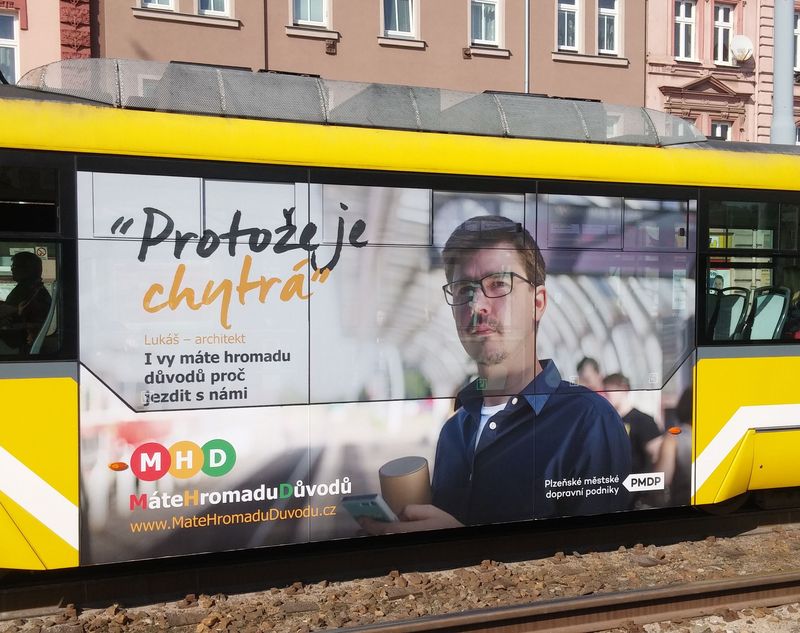
Identify the location of skylight. The height and width of the screenshot is (633, 800). (214, 92).